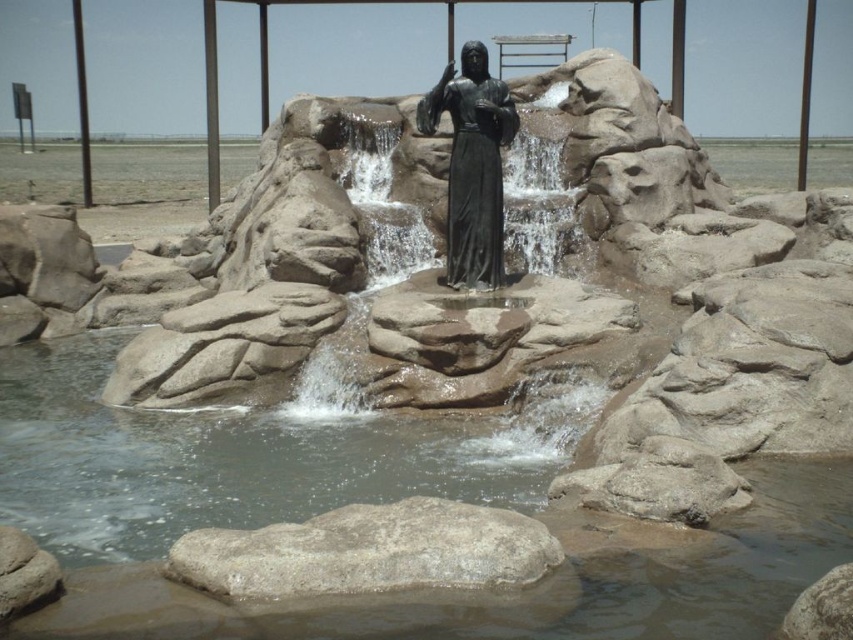
Question: Does smooth stone waterfall at center have a lesser width compared to bronze statue at center?

Choices:
 (A) no
 (B) yes

Answer: (A)

Question: Is gray rough rock at center to the left of bronze statue at center from the viewer's perspective?

Choices:
 (A) no
 (B) yes

Answer: (B)

Question: Is gray rough rock at center above smooth stone waterfall at center?

Choices:
 (A) yes
 (B) no

Answer: (B)

Question: Which point appears farthest from the camera in this image?

Choices:
 (A) (352, 305)
 (B) (440, 81)

Answer: (A)

Question: Which point appears closest to the camera in this image?

Choices:
 (A) (293, 116)
 (B) (479, 131)

Answer: (B)

Question: Which object is closer to the camera taking this photo?

Choices:
 (A) bronze statue at center
 (B) smooth stone waterfall at center

Answer: (B)